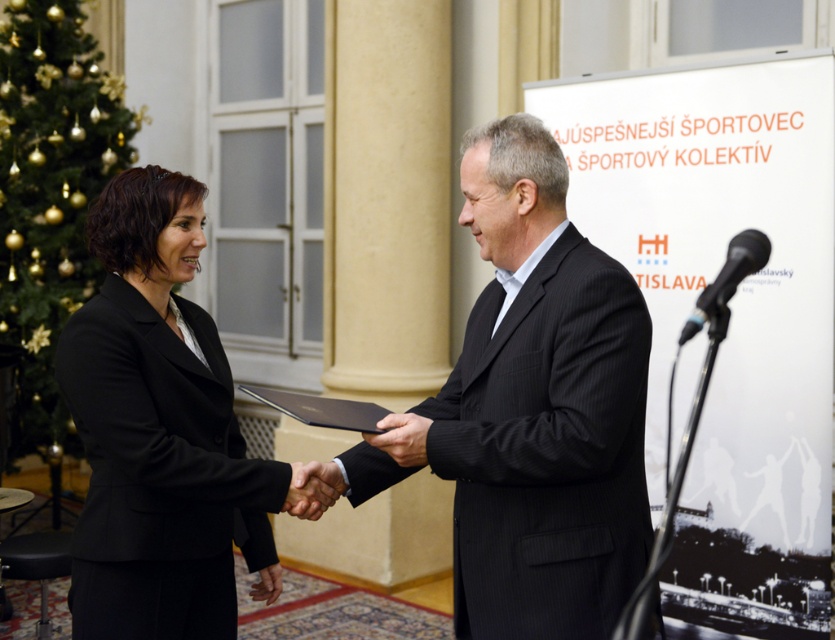
Can you confirm if black matte suit at center is positioned above black leather hand at center?

Yes.

Is black matte suit at center taller than black leather hand at center?

Indeed, black matte suit at center has a greater height compared to black leather hand at center.

Locate an element on the screen. black matte suit at center is located at coordinates (157, 429).

Does black plastic microphone at right have a greater width compared to matte black hand at center?

Yes, black plastic microphone at right is wider than matte black hand at center.

What do you see at coordinates (726, 284) in the screenshot? I see `black plastic microphone at right` at bounding box center [726, 284].

Where is `black plastic microphone at right`? black plastic microphone at right is located at coordinates (726, 284).

Does black leather hand at center have a greater height compared to matte black hand at center?

Yes, black leather hand at center is taller than matte black hand at center.

Is black leather hand at center thinner than matte black hand at center?

No.

Locate an element on the screen. black leather hand at center is located at coordinates (312, 488).

I want to click on black leather hand at center, so click(x=312, y=488).